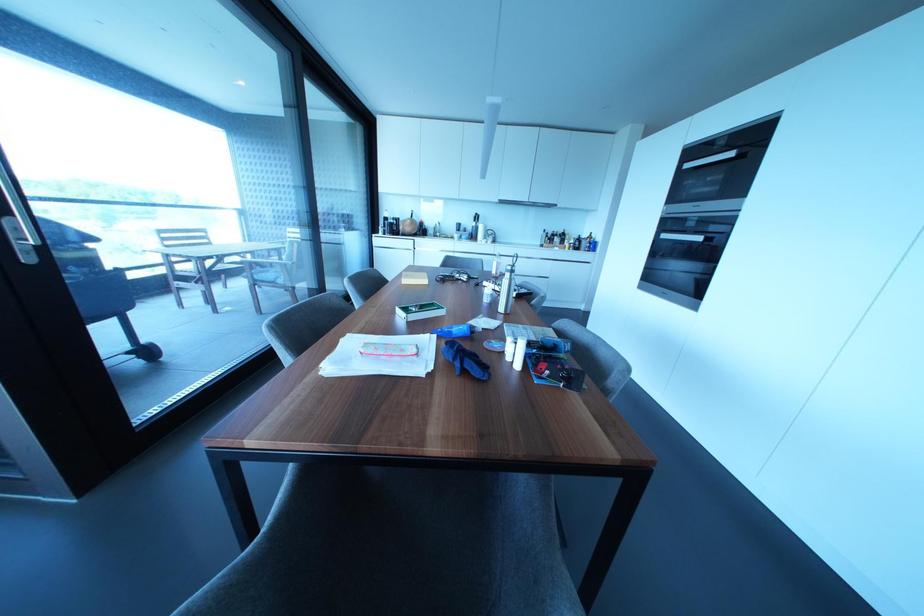
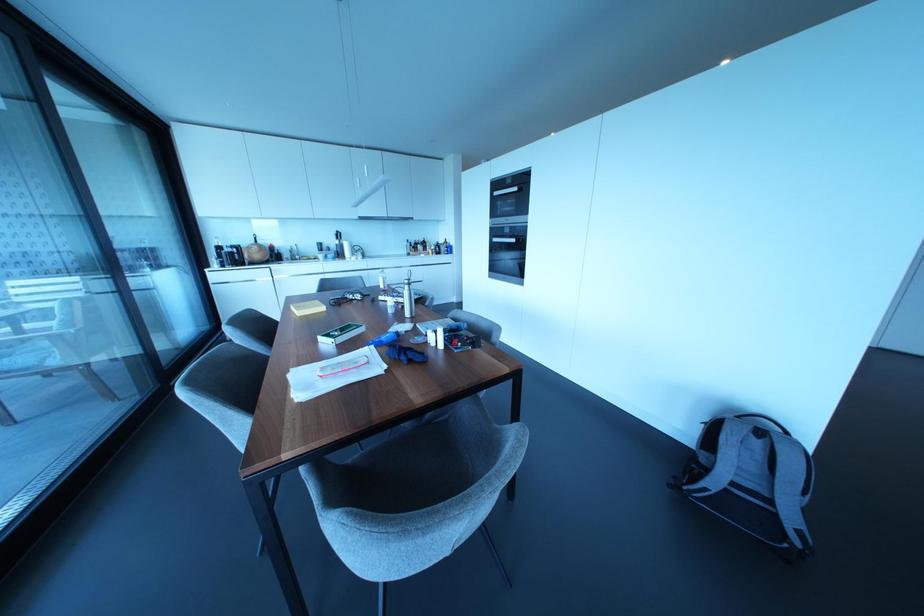
Find the pixel in the second image that matches [730,153] in the first image.

(515, 188)